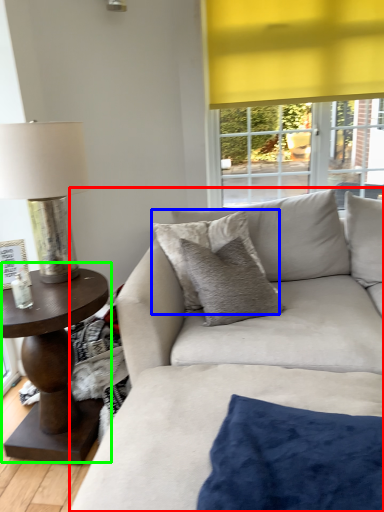
Question: Based on their relative distances, which object is nearer to studio couch (highlighted by a red box)? Choose from pillow (highlighted by a blue box) and coffee table (highlighted by a green box).

Choices:
 (A) pillow
 (B) coffee table

Answer: (A)